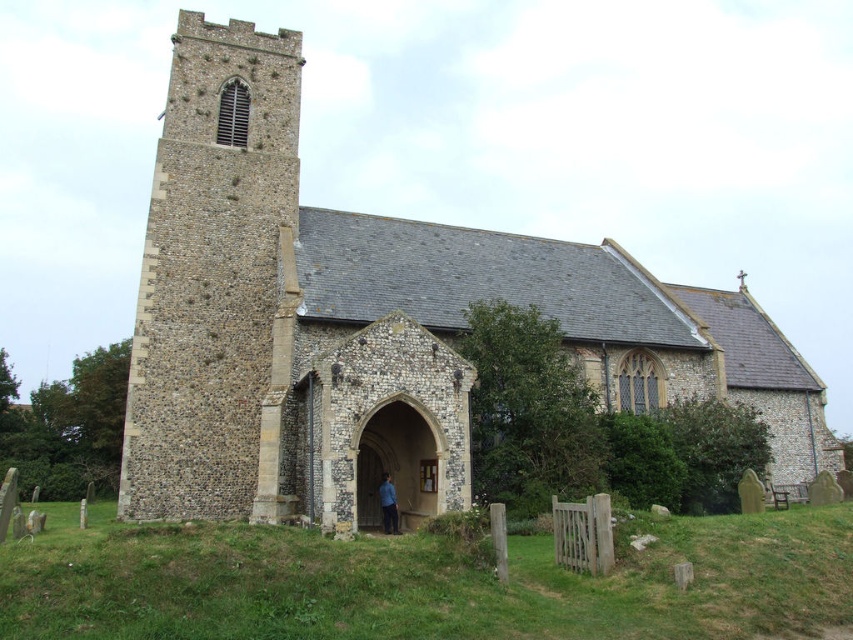
Question: Among these objects, which one is nearest to the camera?

Choices:
 (A) stone church at center
 (B) blue fabric at center

Answer: (A)

Question: Which of the following is the farthest from the observer?

Choices:
 (A) (670, 300)
 (B) (389, 532)

Answer: (A)

Question: Which of the following is the farthest from the observer?

Choices:
 (A) (393, 528)
 (B) (780, 456)

Answer: (B)

Question: Does stone church at center have a smaller size compared to blue fabric at center?

Choices:
 (A) yes
 (B) no

Answer: (B)

Question: Is stone church at center positioned at the back of blue fabric at center?

Choices:
 (A) no
 (B) yes

Answer: (A)

Question: Is stone church at center below blue fabric at center?

Choices:
 (A) yes
 (B) no

Answer: (B)